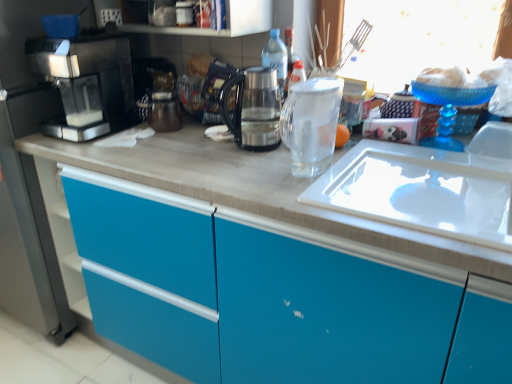
This screenshot has height=384, width=512. What are the coordinates of `free spot to the right of clear glass pitcher at center, the 2th kitchen appliance in the left-to-right sequence` in the screenshot? It's located at (378, 170).